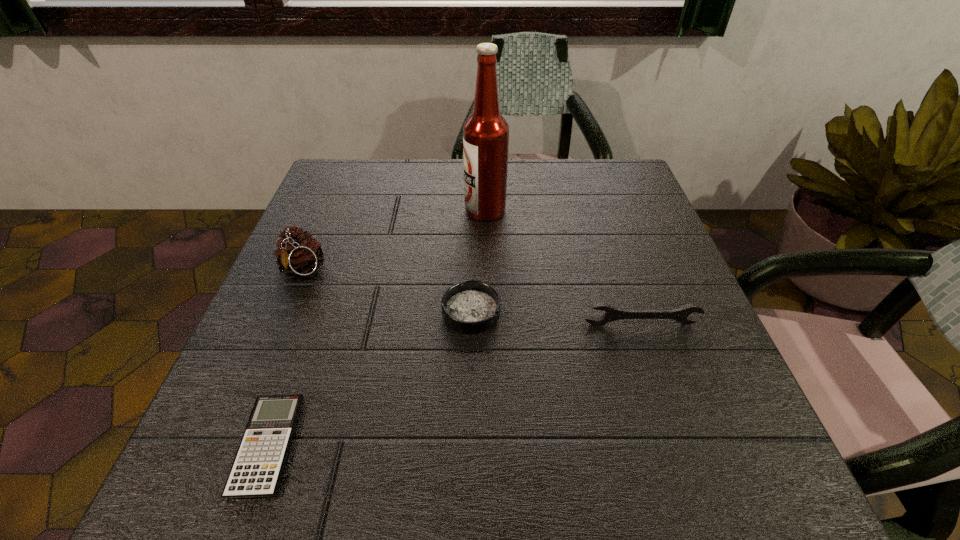
I want to click on the farthest object, so click(485, 133).

I want to click on alcohol, so click(x=485, y=133).

The image size is (960, 540). In order to click on the fourth shortest object in this screenshot , I will do `click(299, 253)`.

Locate an element on the screen. The image size is (960, 540). the third shortest object is located at coordinates (681, 315).

I want to click on wrench, so click(681, 315).

Find the location of a particular element. The image size is (960, 540). ashtray is located at coordinates (472, 307).

Locate an element on the screen. calculator is located at coordinates (256, 472).

Where is `the shortest object`? The width and height of the screenshot is (960, 540). the shortest object is located at coordinates (256, 472).

You are a GUI agent. You are given a task and a screenshot of the screen. Output one action in this format:
    pyautogui.click(x=<x>, y=<y>)
    Task: Click on the free region located 0.280m on the label side of the tallest object
    The width and height of the screenshot is (960, 540).
    Given the screenshot: What is the action you would take?
    pyautogui.click(x=348, y=211)

Locate an element on the screen. Image resolution: width=960 pixels, height=540 pixels. vacant region located on the label side of the tallest object is located at coordinates (402, 211).